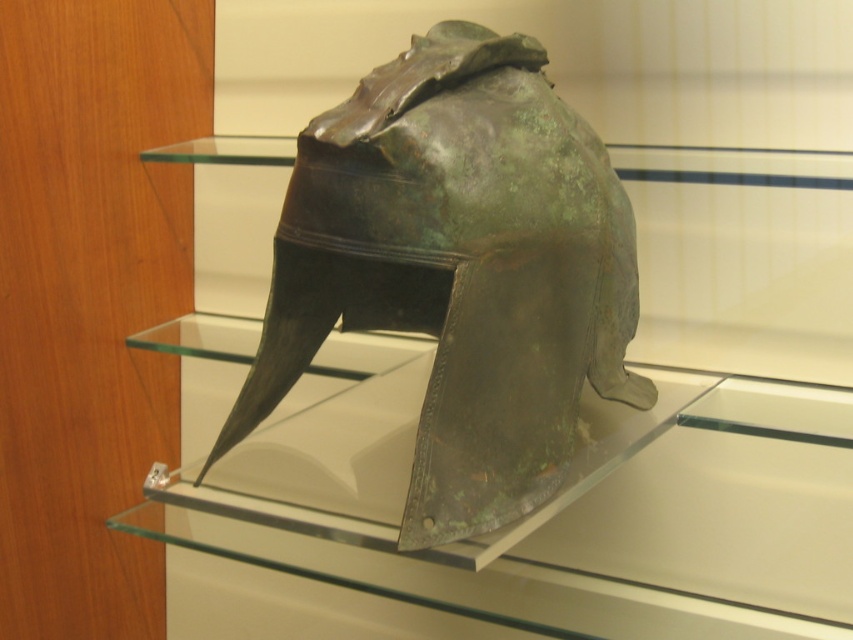
Between transparent glass helmet at center and green patina helmet at center, which one has more height?

Standing taller between the two is transparent glass helmet at center.

Identify the location of transparent glass helmet at center. (579, 458).

Identify the location of transparent glass helmet at center. This screenshot has width=853, height=640. (579, 458).